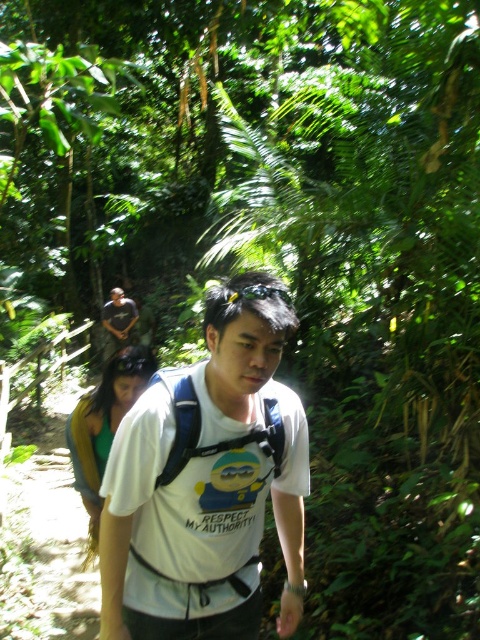
Looking at this image, is white cotton t-shirt at center above dark gray t-shirt at upper left?

Incorrect, white cotton t-shirt at center is not positioned above dark gray t-shirt at upper left.

Locate an element on the screen. The image size is (480, 640). white cotton t-shirt at center is located at coordinates (207, 481).

Where is `white cotton t-shirt at center`? The image size is (480, 640). white cotton t-shirt at center is located at coordinates 207,481.

At what (x,y) coordinates should I click in order to perform the action: click on white cotton t-shirt at center. Please return your answer as a coordinate pair (x, y). Looking at the image, I should click on (207, 481).

Is white cotton t-shirt at center above green fabric backpack at center?

Indeed, white cotton t-shirt at center is positioned over green fabric backpack at center.

From the picture: Can you confirm if white cotton t-shirt at center is wider than green fabric backpack at center?

No.

Between point (237, 604) and point (111, 362), which one is positioned in front?

Positioned in front is point (237, 604).

This screenshot has width=480, height=640. What are the coordinates of `white cotton t-shirt at center` in the screenshot? It's located at (207, 481).

Does green fabric backpack at center have a lesser height compared to dark gray t-shirt at upper left?

Incorrect, green fabric backpack at center's height does not fall short of dark gray t-shirt at upper left's.

Is point (132, 362) positioned in front of point (105, 324)?

Yes, it is in front of point (105, 324).

Identify the location of green fabric backpack at center. (104, 426).